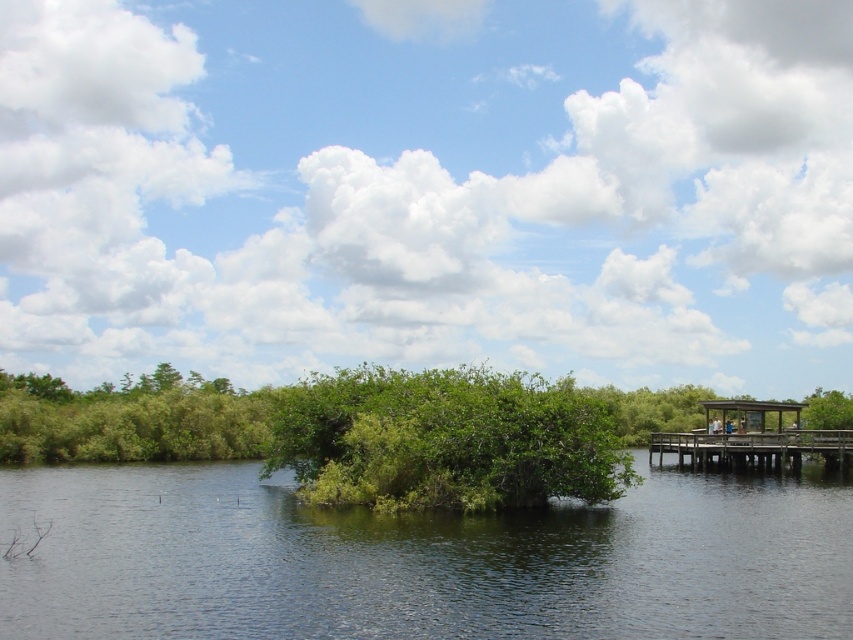
You are standing on the wooden dock and looking towards the middle of the image. Which object, the green leafy river at center or the green leafy bush at center, is closer to you?

The green leafy river at center is closer to you because it is positioned in front of the green leafy bush at center.